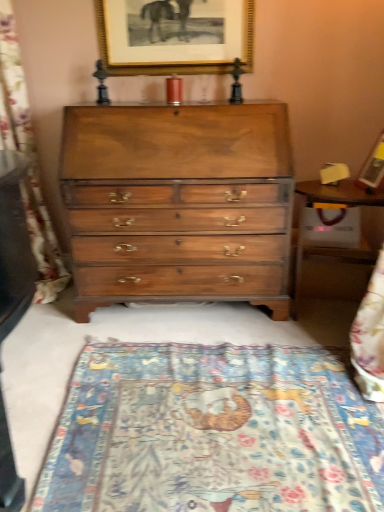
Where is `vacant region in front of shiny brown wood chest of drawers at center`? This screenshot has height=512, width=384. vacant region in front of shiny brown wood chest of drawers at center is located at coordinates (179, 379).